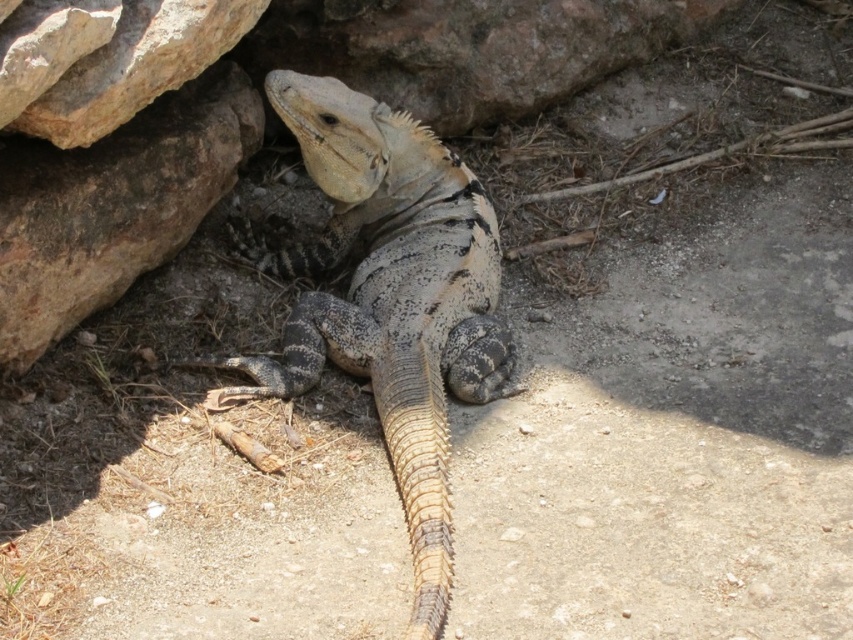
Which is more to the right, speckled scaly lizard at center or brown rough rock at upper left?

From the viewer's perspective, speckled scaly lizard at center appears more on the right side.

This screenshot has height=640, width=853. In order to click on speckled scaly lizard at center in this screenshot , I will do `click(392, 298)`.

Between point (112, 188) and point (172, 67), which one is positioned behind?

The point (112, 188) is behind.

Consider the image. Measure the distance between brown rough rock at upper left and smooth beige rock at upper left.

They are 13.74 inches apart.

Describe the element at coordinates (113, 205) in the screenshot. I see `brown rough rock at upper left` at that location.

Find the location of a particular element. The height and width of the screenshot is (640, 853). brown rough rock at upper left is located at coordinates (113, 205).

Is point (283, 381) positioned before point (146, 60)?

No, it is not.

Who is more distant from viewer, (430, 291) or (22, 120)?

The point (430, 291) is more distant.

Between point (426, 490) and point (109, 112), which one is positioned in front?

Point (109, 112)

You are a GUI agent. You are given a task and a screenshot of the screen. Output one action in this format:
    pyautogui.click(x=<x>, y=<y>)
    Task: Click on the speckled scaly lizard at center
    This screenshot has width=853, height=640.
    Given the screenshot: What is the action you would take?
    pyautogui.click(x=392, y=298)